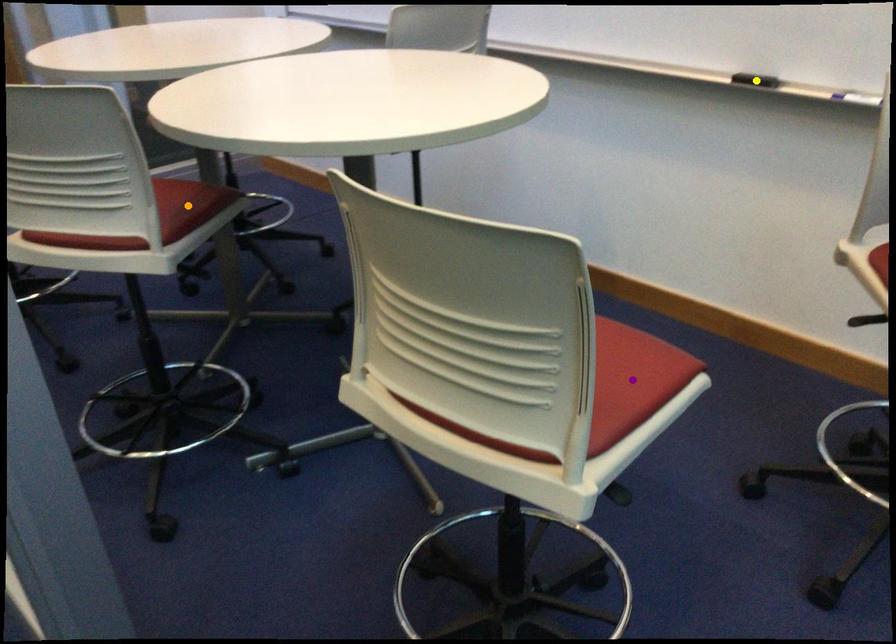
Order these from nearest to farthest:
yellow point, orange point, purple point

purple point → orange point → yellow point